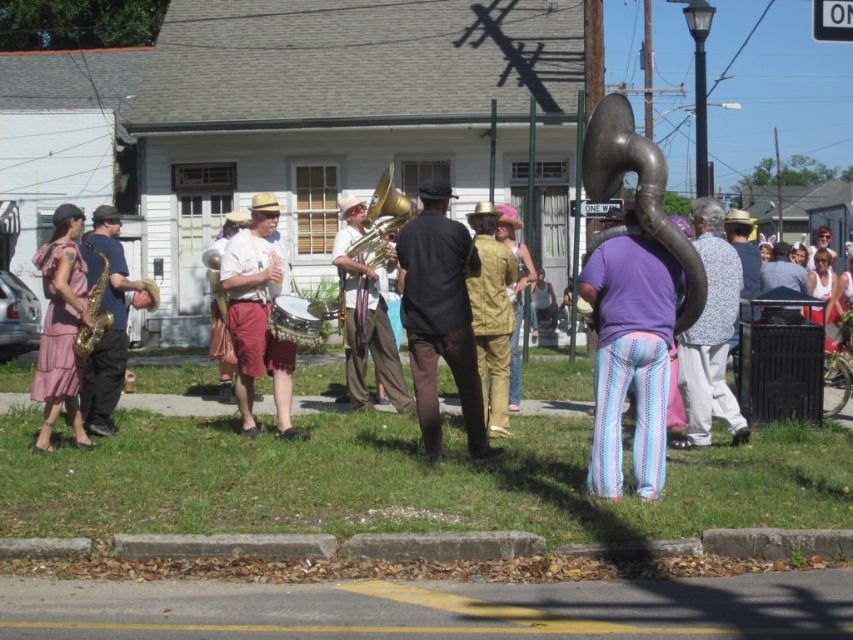
Question: Can you confirm if gold brass trumpet at center is bigger than light brown leather jacket at center?

Choices:
 (A) yes
 (B) no

Answer: (B)

Question: Is gold shiny saxophone at left to the right of gold brass trumpet at center from the viewer's perspective?

Choices:
 (A) no
 (B) yes

Answer: (A)

Question: Which object is the farthest from the gold lacquered saxophone at left?

Choices:
 (A) light brown leather jacket at center
 (B) light brown leather shorts at center
 (C) gold brass trumpet at center
 (D) black matte shirt at center

Answer: (A)

Question: Is gold shiny saxophone at left closer to camera compared to gold brass trumpet at center?

Choices:
 (A) no
 (B) yes

Answer: (B)

Question: Which object appears farthest from the camera in this image?

Choices:
 (A) light brown leather shorts at center
 (B) light brown leather jacket at center

Answer: (B)

Question: Which object appears farthest from the camera in this image?

Choices:
 (A) gold brass trumpet at center
 (B) shiny gold tuba at center

Answer: (B)